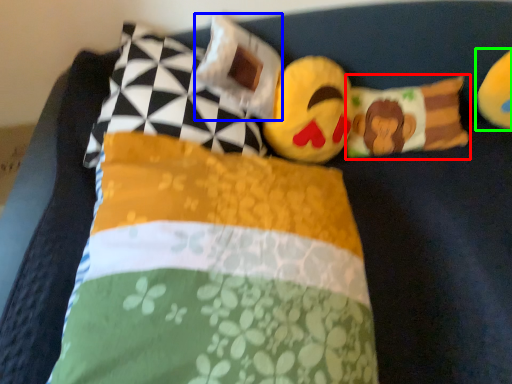
Question: Which is nearer to the pillow (highlighted by a red box)? pillow (highlighted by a blue box) or toy (highlighted by a green box).

Choices:
 (A) pillow
 (B) toy

Answer: (B)